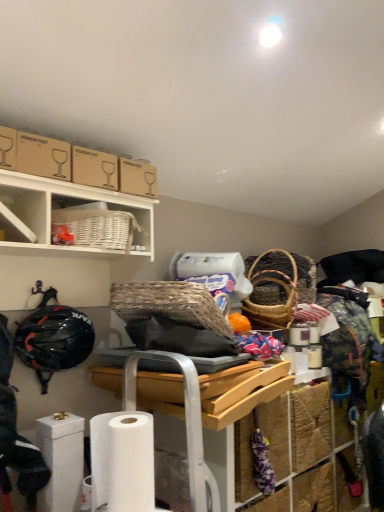
Question: Based on their positions, is brown cardboard box at upper left located to the left or right of white wicker basket at upper center, the second shelf positioned from the left?

Choices:
 (A) right
 (B) left

Answer: (B)

Question: From their relative heights in the image, would you say brown cardboard box at upper left is taller or shorter than white wicker basket at upper center, which ranks as the first shelf in right-to-left order?

Choices:
 (A) short
 (B) tall

Answer: (A)

Question: Which object is the closest to the matte cardboard box at upper left?

Choices:
 (A) wooden tray at center
 (B) brown cardboard box at upper left
 (C) white matte cabinet at upper left
 (D) white matte toilet paper at lower left, placed as the second toilet paper when sorted from right to left
 (E) white matte toilet paper at lower left, the 1th toilet paper positioned from the front

Answer: (B)

Question: Estimate the real-world distances between objects in this image. Which object is farther from the white wicker basket at upper left, positioned as the 2th shelf in right-to-left order?

Choices:
 (A) matte cardboard box at upper left
 (B) brown cardboard box at upper left
 (C) white matte toilet paper at lower left, arranged as the second toilet paper when viewed from the left
 (D) black matte helmet at left
 (E) white wicker basket at upper center, the second shelf positioned from the left

Answer: (C)